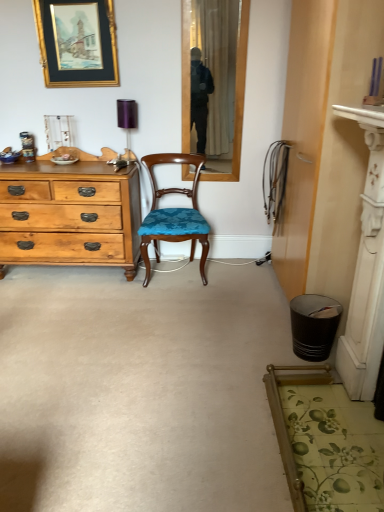
Where is `purple fabric lampshade at upper center`? The image size is (384, 512). purple fabric lampshade at upper center is located at coordinates (127, 119).

From the picture: Considering the relative positions of purple fabric lampshade at upper center and wooden chair with blue upholstery at center in the image provided, is purple fabric lampshade at upper center to the left or to the right of wooden chair with blue upholstery at center?

purple fabric lampshade at upper center is positioned on wooden chair with blue upholstery at center's left side.

Which is correct: purple fabric lampshade at upper center is inside wooden chair with blue upholstery at center, or outside of it?

purple fabric lampshade at upper center is spatially situated outside wooden chair with blue upholstery at center.

Which object is more forward, purple fabric lampshade at upper center or wooden chair with blue upholstery at center?

wooden chair with blue upholstery at center is closer to the camera.

Is purple fabric lampshade at upper center next to wooden chair with blue upholstery at center?

No, purple fabric lampshade at upper center is not with wooden chair with blue upholstery at center.

Is metallic can at left positioned far away from purple fabric lampshade at upper center?

metallic can at left is near purple fabric lampshade at upper center, not far away.

Consider the image. Is metallic can at left bigger than purple fabric lampshade at upper center?

Incorrect, metallic can at left is not larger than purple fabric lampshade at upper center.

From a real-world perspective, which is physically below, metallic can at left or purple fabric lampshade at upper center?

metallic can at left is physically lower.

From the image's perspective, is metallic can at left on top of purple fabric lampshade at upper center?

Actually, metallic can at left appears below purple fabric lampshade at upper center in the image.

From the image's perspective, would you say metallic can at left is positioned over gold-framed picture at upper left?

Actually, metallic can at left appears below gold-framed picture at upper left in the image.

How much distance is there between metallic can at left and gold-framed picture at upper left?

metallic can at left is 28.76 inches away from gold-framed picture at upper left.

Are metallic can at left and gold-framed picture at upper left located far from each other?

No.

Between metallic can at left and gold-framed picture at upper left, which one has larger width?

metallic can at left.

Can you tell me how much gold-framed picture at upper left and purple fabric lampshade at upper center differ in facing direction?

gold-framed picture at upper left and purple fabric lampshade at upper center are facing 0.76 degrees away from each other.

In the scene shown: Is gold-framed picture at upper left situated inside purple fabric lampshade at upper center or outside?

gold-framed picture at upper left is spatially situated outside purple fabric lampshade at upper center.

From a real-world perspective, is gold-framed picture at upper left positioned under purple fabric lampshade at upper center based on gravity?

No, from a real-world perspective, gold-framed picture at upper left is not beneath purple fabric lampshade at upper center.

Based on the photo, in terms of height, does gold-framed picture at upper left look taller or shorter compared to purple fabric lampshade at upper center?

gold-framed picture at upper left is taller than purple fabric lampshade at upper center.

Considering the relative sizes of black textured trash can at lower right and metallic can at left in the image provided, is black textured trash can at lower right shorter than metallic can at left?

In fact, black textured trash can at lower right may be taller than metallic can at left.

Is black textured trash can at lower right inside or outside of metallic can at left?

The correct answer is: outside.

Is black textured trash can at lower right far from metallic can at left?

Yes, black textured trash can at lower right and metallic can at left are located far from each other.

Which of these two, black textured trash can at lower right or metallic can at left, is wider?

With larger width is black textured trash can at lower right.

Who is more distant, wooden chair with blue upholstery at center or gold-framed picture at upper left?

gold-framed picture at upper left is more distant.

In terms of size, does wooden chair with blue upholstery at center appear bigger or smaller than gold-framed picture at upper left?

In the image, wooden chair with blue upholstery at center appears to be larger than gold-framed picture at upper left.

I want to click on chair beneath the gold-framed picture at upper left (from a real-world perspective), so click(174, 214).

Between wooden chair with blue upholstery at center and gold-framed picture at upper left, which one has larger width?

With larger width is wooden chair with blue upholstery at center.

From the image's perspective, does metallic can at left appear lower than wooden chair with blue upholstery at center?

No.

Is metallic can at left positioned beyond the bounds of wooden chair with blue upholstery at center?

Absolutely, metallic can at left is external to wooden chair with blue upholstery at center.

Would you consider metallic can at left to be distant from wooden chair with blue upholstery at center?

Yes, metallic can at left and wooden chair with blue upholstery at center are located far from each other.

I want to click on lamp located above the wooden chair with blue upholstery at center (from the image's perspective), so click(127, 119).

Find the location of a particular element. Image resolution: width=384 pixels, height=512 pixels. bottle lying behind the purple fabric lampshade at upper center is located at coordinates [x=28, y=146].

Which object lies further to the anchor point black textured trash can at lower right, metallic can at left or purple fabric lampshade at upper center?

metallic can at left lies further to black textured trash can at lower right than the other object.

Looking at the image, which one is located further to black textured trash can at lower right, gold-framed picture at upper left or metallic can at left?

Based on the image, gold-framed picture at upper left appears to be further to black textured trash can at lower right.

When comparing their distances from gold-framed picture at upper left, does black textured trash can at lower right or wooden chair with blue upholstery at center seem further?

black textured trash can at lower right lies further to gold-framed picture at upper left than the other object.

Based on their spatial positions, is wooden chair with blue upholstery at center or gold-framed picture at upper left closer to purple fabric lampshade at upper center?

gold-framed picture at upper left is positioned closer to the anchor purple fabric lampshade at upper center.

Based on their spatial positions, is purple fabric lampshade at upper center or metallic can at left further from wooden chair with blue upholstery at center?

metallic can at left.

Which object lies nearer to the anchor point gold-framed picture at upper left, black textured trash can at lower right or metallic can at left?

The object closer to gold-framed picture at upper left is metallic can at left.

Estimate the real-world distances between objects in this image. Which object is closer to metallic can at left, gold-framed picture at upper left or purple fabric lampshade at upper center?

purple fabric lampshade at upper center is closer to metallic can at left.

Considering their positions, is gold-framed picture at upper left positioned closer to purple fabric lampshade at upper center than black textured trash can at lower right?

gold-framed picture at upper left is positioned closer to the anchor purple fabric lampshade at upper center.

The width and height of the screenshot is (384, 512). Identify the location of lamp between metallic can at left and black textured trash can at lower right in the horizontal direction. (127, 119).

Identify the location of picture frame between metallic can at left and black textured trash can at lower right in the horizontal direction. The height and width of the screenshot is (512, 384). (77, 42).

At what (x,y) coordinates should I click in order to perform the action: click on bottle between gold-framed picture at upper left and wooden chair with blue upholstery at center in the up-down direction. Please return your answer as a coordinate pair (x, y). This screenshot has height=512, width=384. Looking at the image, I should click on (28, 146).

At what (x,y) coordinates should I click in order to perform the action: click on chair located between metallic can at left and black textured trash can at lower right in the left-right direction. Please return your answer as a coordinate pair (x, y). The image size is (384, 512). Looking at the image, I should click on (174, 214).